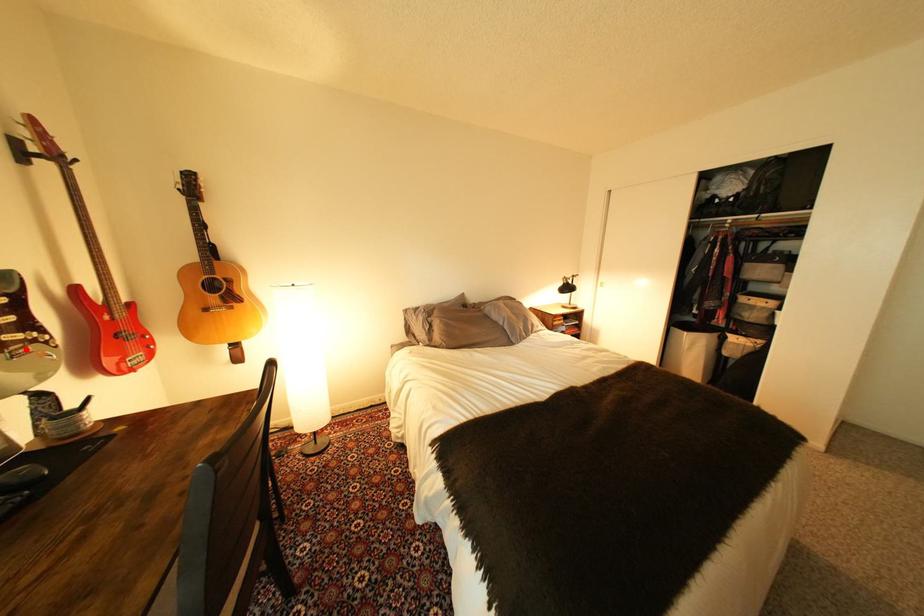
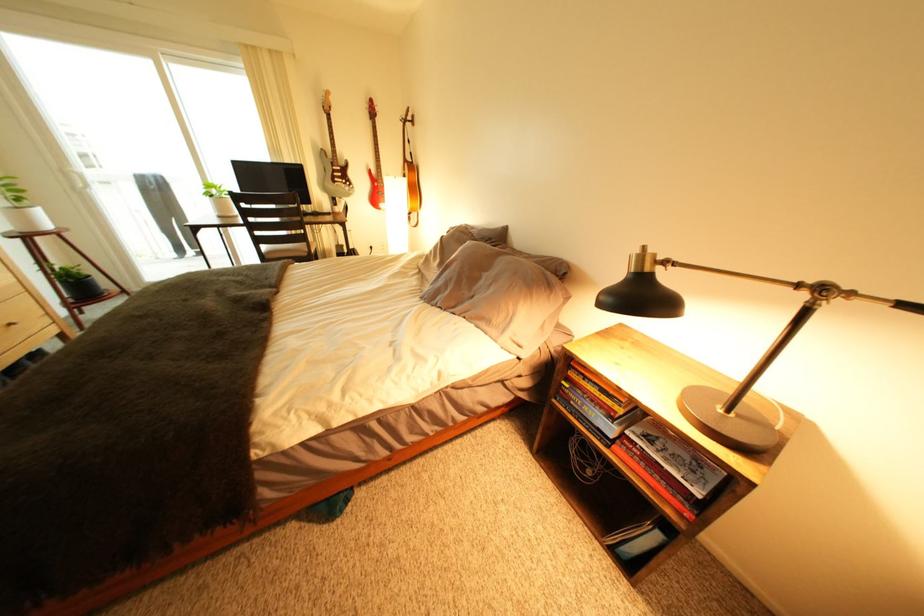
Question: I am providing you with two images of the same scene from different viewpoints. Given a red point in image1, look at the same physical point in image2. Is it:

Choices:
 (A) Closer to the viewpoint
 (B) Farther from the viewpoint

Answer: (A)